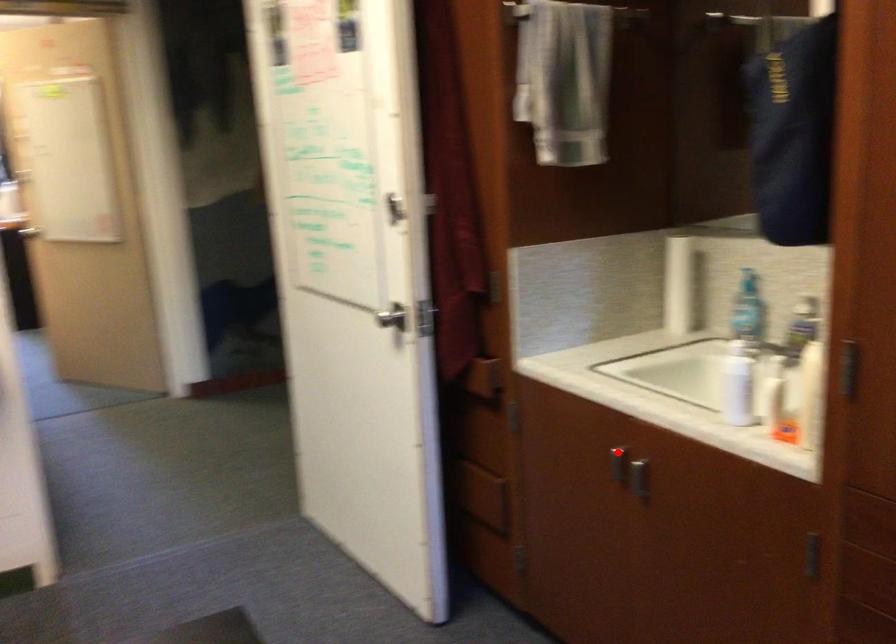
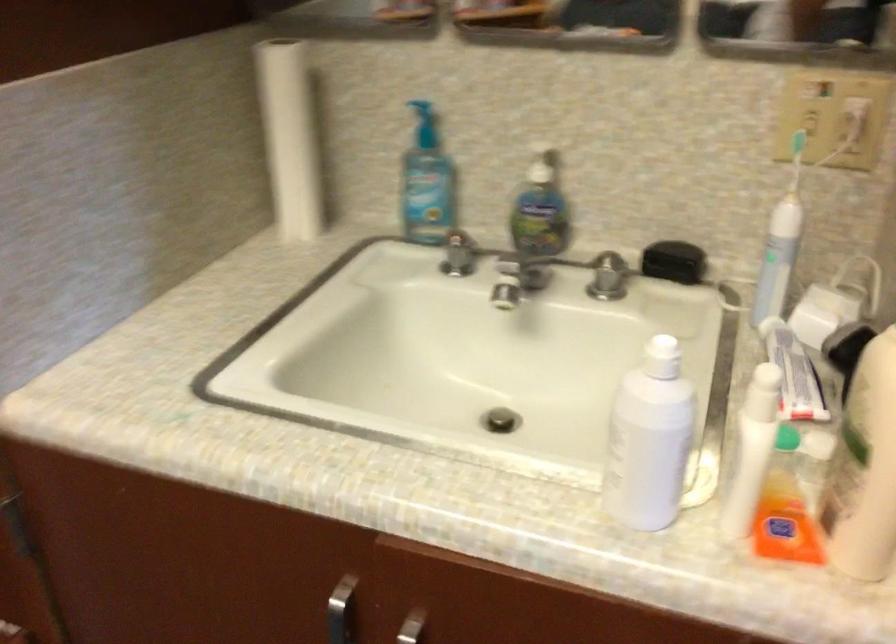
Question: I am providing you with two images of the same scene from different viewpoints. A red point is marked on the first image. At the location where the point appears in image 1, is it still visible in image 2?

Choices:
 (A) Yes
 (B) No

Answer: (A)